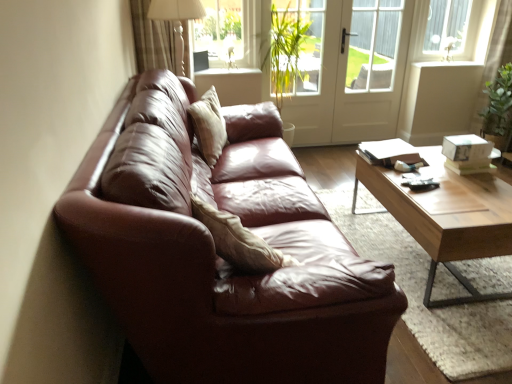
At what (x,y) coordinates should I click in order to perform the action: click on free point below light brown wooden coffee table at center (from a real-world perspective). Please return your answer as a coordinate pair (x, y). Image resolution: width=512 pixels, height=384 pixels. Looking at the image, I should click on (415, 256).